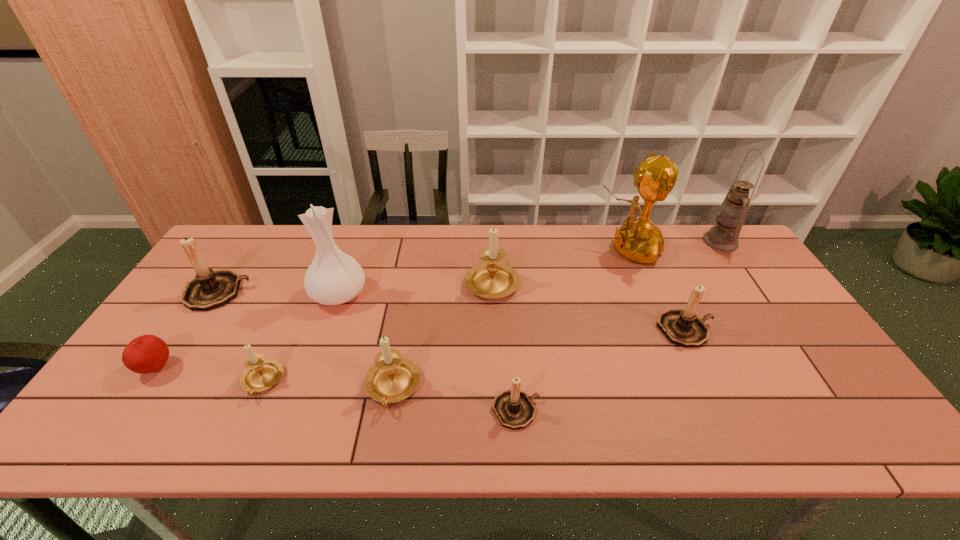
Image resolution: width=960 pixels, height=540 pixels. I want to click on free region at the far edge, so click(564, 260).

This screenshot has height=540, width=960. In the image, there is a desktop. Identify the location of blank space at the near edge. (261, 416).

The image size is (960, 540). In order to click on free region at the right edge in this screenshot , I will do `click(748, 275)`.

In the image, there is a desktop. In order to click on vacant space at the far left corner in this screenshot , I will do `click(256, 228)`.

Find the location of a particular element. The image size is (960, 540). vacant area at the near left corner is located at coordinates (111, 437).

You are a GUI agent. You are given a task and a screenshot of the screen. Output one action in this format:
    pyautogui.click(x=<x>, y=<y>)
    Task: Click on the vacant space at the near right corner
    Image resolution: width=960 pixels, height=540 pixels.
    Given the screenshot: What is the action you would take?
    click(807, 421)

This screenshot has width=960, height=540. I want to click on unoccupied area between the biggest beige candle holder and the second biggest brown candle holder, so click(x=588, y=305).

At what (x,y) coordinates should I click in order to perform the action: click on free space between the white vase and the sixth object from right to left. Please return your answer as a coordinate pair (x, y). This screenshot has height=540, width=960. Looking at the image, I should click on (366, 341).

This screenshot has width=960, height=540. I want to click on vacant area that lies between the biggest brown candle holder and the award, so click(x=422, y=271).

Image resolution: width=960 pixels, height=540 pixels. What are the coordinates of `vacant space in between the farthest beige candle holder and the second smallest brown candle holder` in the screenshot? It's located at (588, 305).